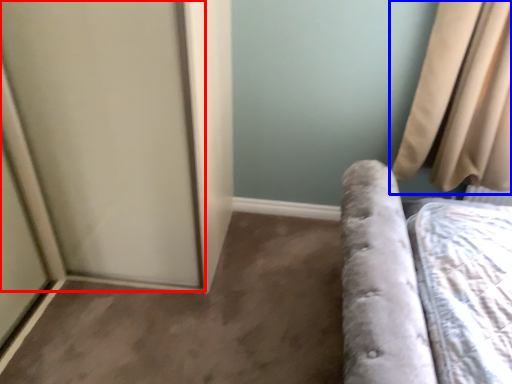
Question: Among these objects, which one is farthest to the camera, screen door (highlighted by a red box) or curtain (highlighted by a blue box)?

Choices:
 (A) screen door
 (B) curtain

Answer: (B)